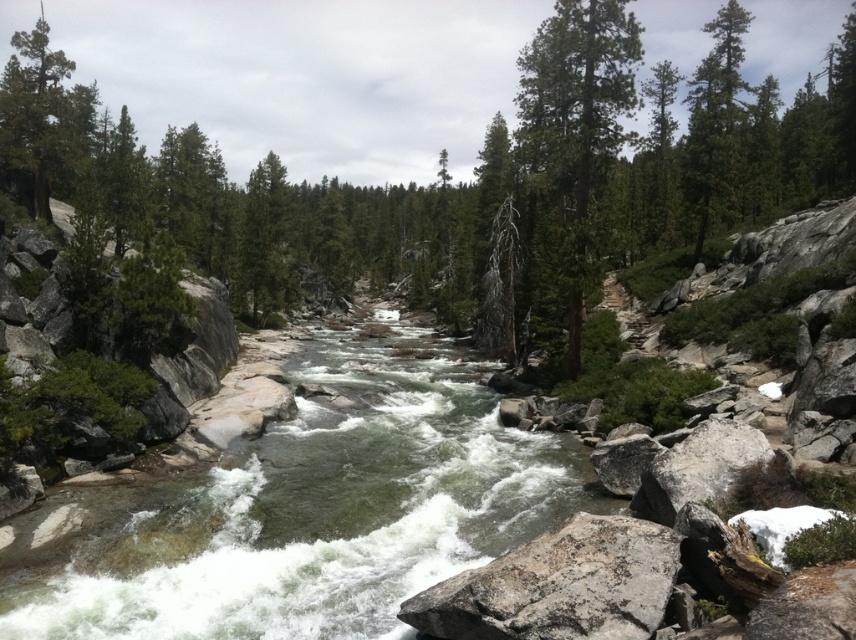
Question: Which point is closer to the camera?

Choices:
 (A) green matte tree at center
 (B) green matte tree at upper left

Answer: (A)

Question: Is green textured tree at center below green matte tree at upper left?

Choices:
 (A) no
 (B) yes

Answer: (B)

Question: Which object appears closest to the camera in this image?

Choices:
 (A) green textured tree at center
 (B) gray rough rock at center

Answer: (B)

Question: In this image, where is gray rough rock at center located relative to green matte tree at upper left?

Choices:
 (A) above
 (B) below

Answer: (B)

Question: Can you confirm if gray rough rock at center is bigger than green matte tree at center?

Choices:
 (A) yes
 (B) no

Answer: (B)

Question: Which of the following is the farthest from the observer?

Choices:
 (A) (438, 588)
 (B) (49, 28)
 (C) (623, 20)
 (D) (21, 147)

Answer: (B)